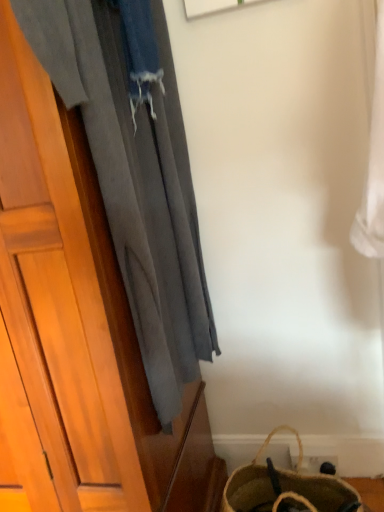
Question: From a real-world perspective, is brown woven bag at lower right beneath gray fabric curtain at left?

Choices:
 (A) no
 (B) yes

Answer: (B)

Question: Does brown woven bag at lower right have a larger size compared to gray fabric curtain at left?

Choices:
 (A) no
 (B) yes

Answer: (A)

Question: Could you tell me if brown woven bag at lower right is turned towards gray fabric curtain at left?

Choices:
 (A) yes
 (B) no

Answer: (B)

Question: Can you confirm if brown woven bag at lower right is shorter than gray fabric curtain at left?

Choices:
 (A) yes
 (B) no

Answer: (A)

Question: From the image's perspective, is brown woven bag at lower right on gray fabric curtain at left?

Choices:
 (A) yes
 (B) no

Answer: (B)

Question: Is the depth of brown woven bag at lower right less than that of gray fabric curtain at left?

Choices:
 (A) yes
 (B) no

Answer: (B)

Question: Considering the relative sizes of gray fabric curtain at left and brown woven bag at lower right in the image provided, is gray fabric curtain at left taller than brown woven bag at lower right?

Choices:
 (A) no
 (B) yes

Answer: (B)

Question: Would you say brown woven bag at lower right is part of gray fabric curtain at left's contents?

Choices:
 (A) yes
 (B) no

Answer: (B)

Question: Is gray fabric curtain at left with brown woven bag at lower right?

Choices:
 (A) no
 (B) yes

Answer: (A)

Question: Are gray fabric curtain at left and brown woven bag at lower right located far from each other?

Choices:
 (A) no
 (B) yes

Answer: (A)

Question: From a real-world perspective, is gray fabric curtain at left located beneath brown woven bag at lower right?

Choices:
 (A) yes
 (B) no

Answer: (B)

Question: Is gray fabric curtain at left positioned with its back to brown woven bag at lower right?

Choices:
 (A) no
 (B) yes

Answer: (A)

Question: In the image, is brown woven bag at lower right positioned in front of or behind gray fabric curtain at left?

Choices:
 (A) front
 (B) behind

Answer: (B)